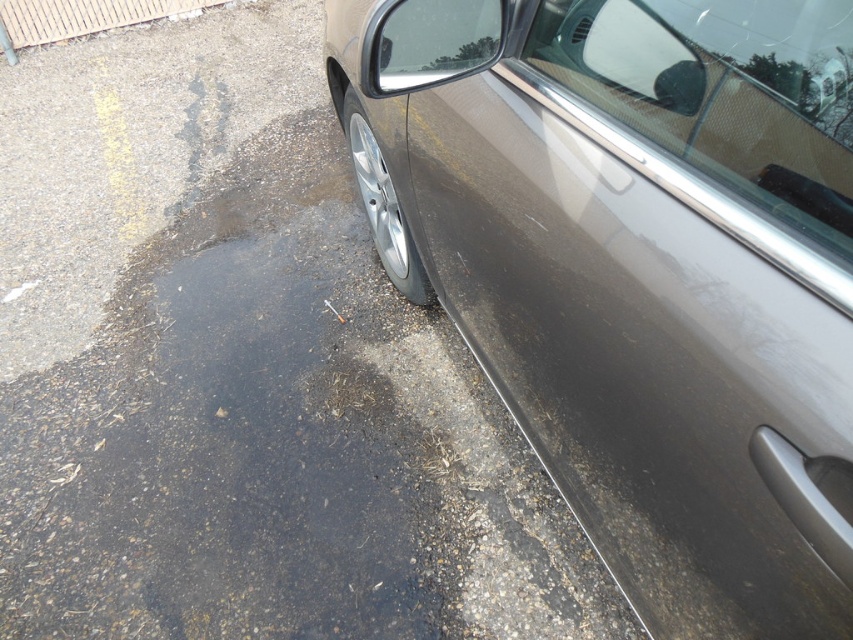
Is point (733, 632) more distant than point (223, 524)?

That is False.

Who is more forward, (622, 97) or (198, 371)?

Positioned in front is point (622, 97).

Find the location of `satin metallic car door at center-right`. satin metallic car door at center-right is located at coordinates (637, 269).

I want to click on satin metallic car door at center-right, so click(x=637, y=269).